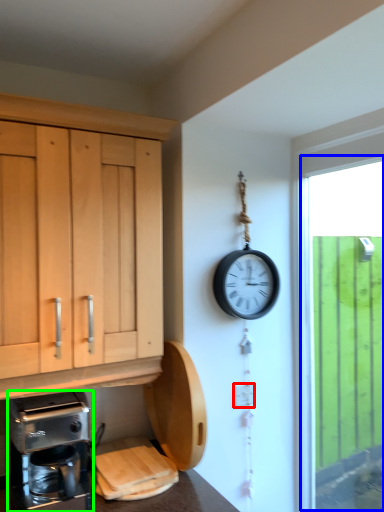
Question: Which object is the farthest from electric outlet (highlighted by a red box)? Choose among these: window (highlighted by a blue box) or coffee maker (highlighted by a green box).

Choices:
 (A) window
 (B) coffee maker

Answer: (A)